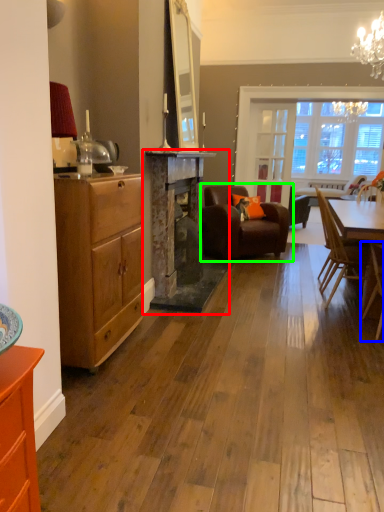
Question: Which object is positioned farthest from fireplace (highlighted by a red box)? Select from chair (highlighted by a blue box) and chair (highlighted by a green box).

Choices:
 (A) chair
 (B) chair

Answer: (A)